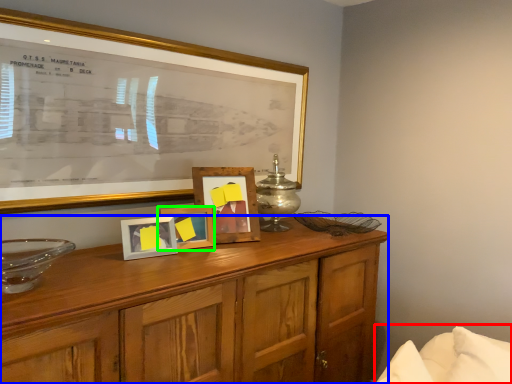
Question: Considering the real-world distances, which object is farthest from bed (highlighted by a red box)? cabinetry (highlighted by a blue box) or picture frame (highlighted by a green box)?

Choices:
 (A) cabinetry
 (B) picture frame

Answer: (B)